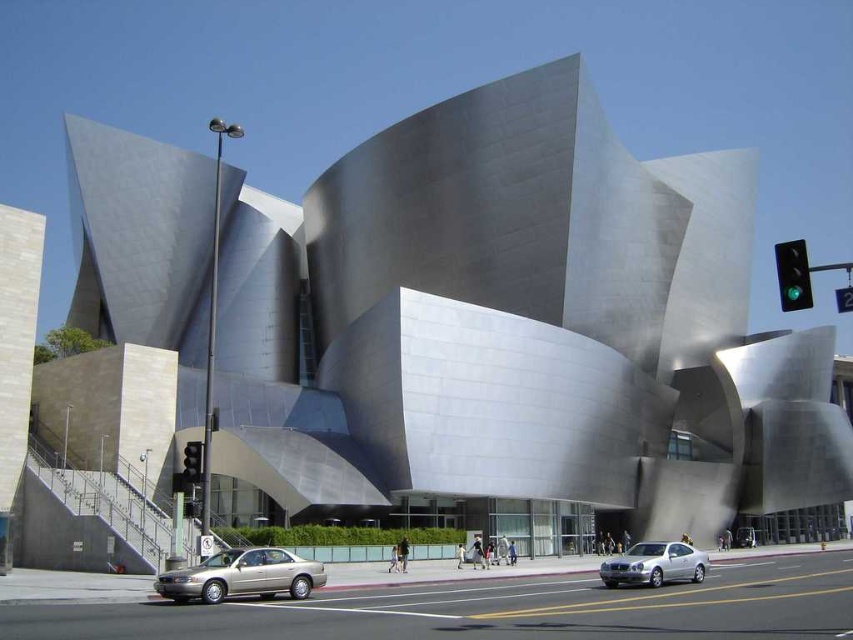
You are a tour guide leading a group near the Walt Disney Concert Hall. You notice a silver metallic car at lower right and a green glass traffic light at upper right. Your group asks if they can walk from the car to the traffic light in 10 seconds. Assuming an average walking speed of 3 feet per second, can they make it?

The silver metallic car at lower right and green glass traffic light at upper right are 69.04 feet apart from each other. At an average walking speed of 3 feet per second, it would take approximately 23.01 seconds to cover the distance. Therefore, the group cannot reach the traffic light in 10 seconds.

You are a delivery driver approaching the Walt Disney Concert Hall. Your truck is 2 meters wide. You see a gold metallic sedan at lower center and a red glass traffic light at lower left. Can your truck pass between them without touching either?

The gold metallic sedan at lower center might be wider than the red glass traffic light at lower left, so there is uncertainty about the available space. To ensure safety, it is advisable to avoid passing between them or check the exact width measurements before proceeding.